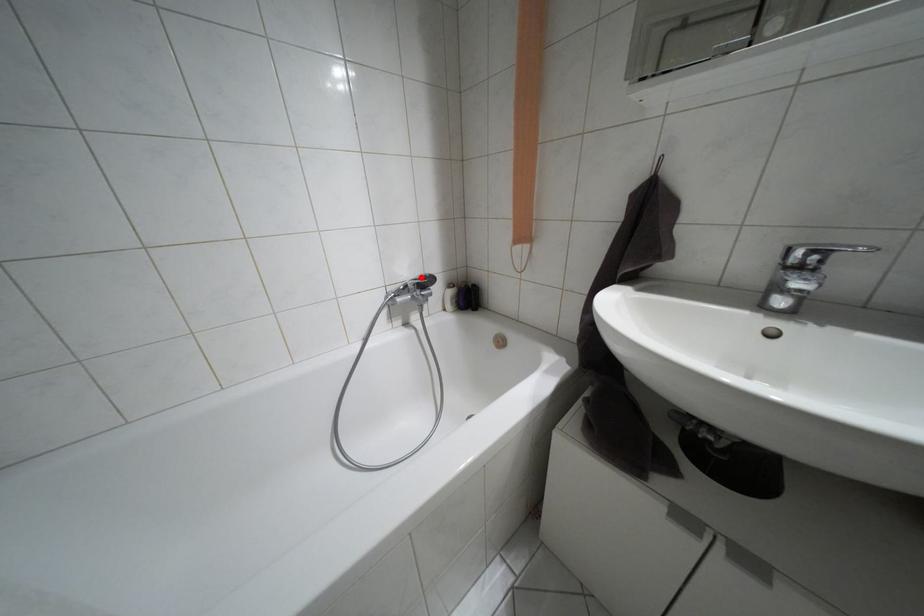
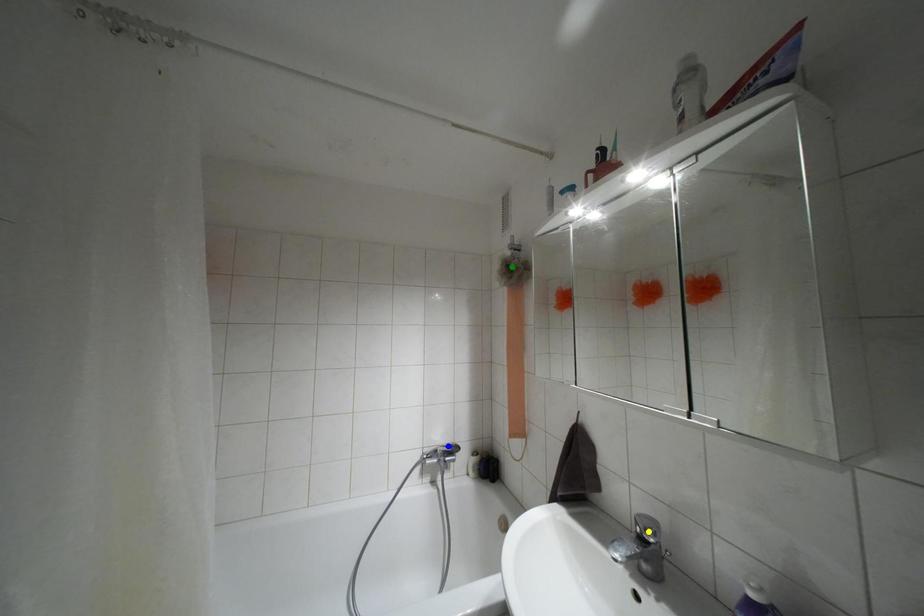
Question: I am providing you with two images of the same scene from different viewpoints. A red point is marked on the first image. You are given multiple points on the second image. Which point in image 2 represents the same 3d spot as the red point in image 1?

Choices:
 (A) yellow point
 (B) green point
 (C) blue point

Answer: (C)